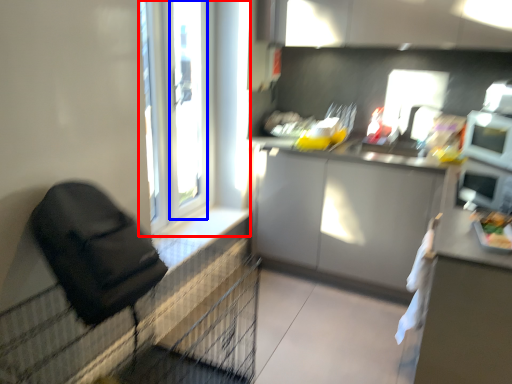
Question: Which object is further to the camera taking this photo, window (highlighted by a red box) or window frame (highlighted by a blue box)?

Choices:
 (A) window
 (B) window frame

Answer: (B)